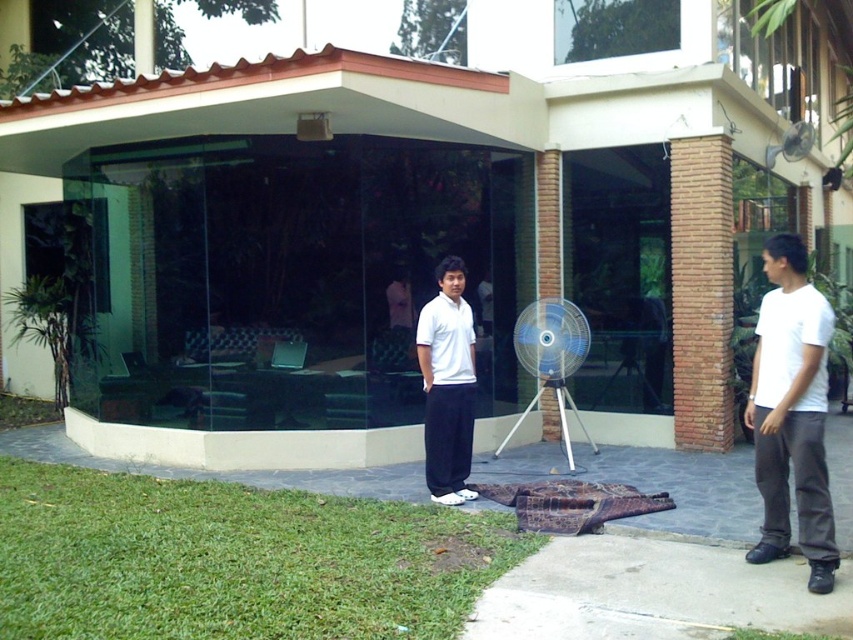
You are a photographer setting up a shoot in the described outdoor scene. You have a camera with a 10cm wide lens. You want to capture both the white matte shirt at right and the white plastic fan at center in your shot. Which object will require you to adjust your camera angle more to ensure it fits within the frame?

The white plastic fan at center will require more adjustment since it is wider than the white matte shirt at right, and the camera lens is only 10cm wide.

You are standing in the outdoor area near the modern building. There are two fans present. The white plastic fan at center and the metallic silver fan at upper right. Which fan is closer to you?

The white plastic fan at center is closer to the viewer than the metallic silver fan at upper right.

You are planning to hang a picture frame that requires a support hook. You see a white plastic fan at center and a metallic silver fan at upper right. Which object is taller and thus more suitable for placing the hook?

The white plastic fan at center is much taller than the metallic silver fan at upper right, so it is more suitable for placing the hook.